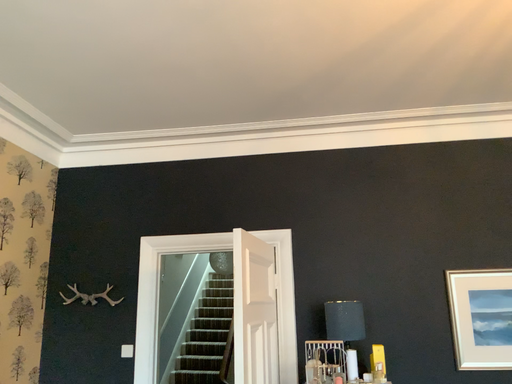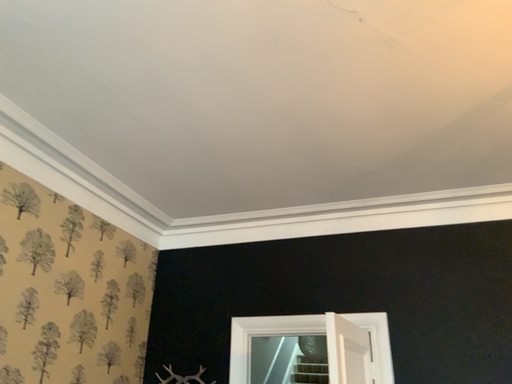
Question: Which way did the camera rotate in the video?

Choices:
 (A) rotated upward
 (B) rotated downward

Answer: (A)